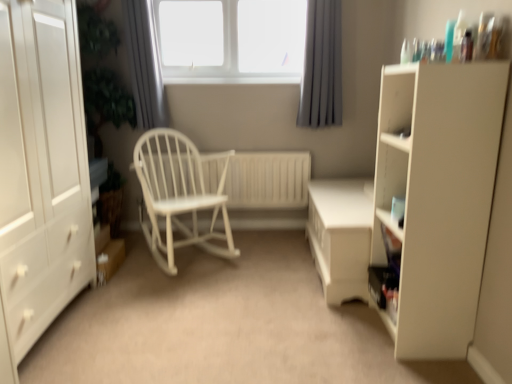
You are a GUI agent. You are given a task and a screenshot of the screen. Output one action in this format:
    pyautogui.click(x=<x>, y=<y>)
    Task: Click on the free space above white glossy table at center (from a real-world perspective)
    
    Given the screenshot: What is the action you would take?
    [346, 190]